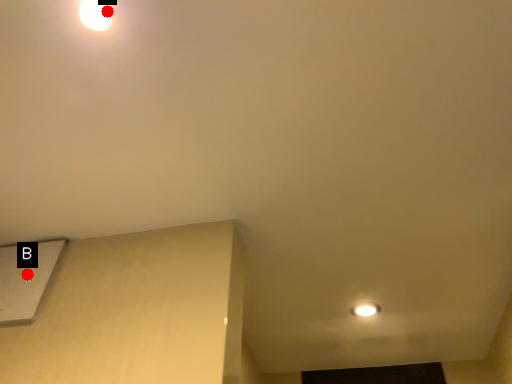
Question: Two points are circled on the image, labeled by A and B beside each circle. Which point is further to the camera?

Choices:
 (A) A is further
 (B) B is further

Answer: (B)